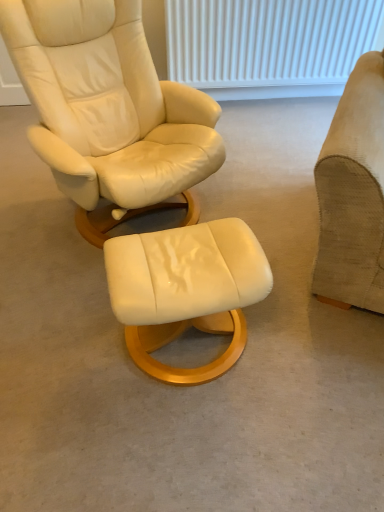
Where is `vacant space positioned to the left of matte cream leather stool at center`? vacant space positioned to the left of matte cream leather stool at center is located at coordinates (67, 344).